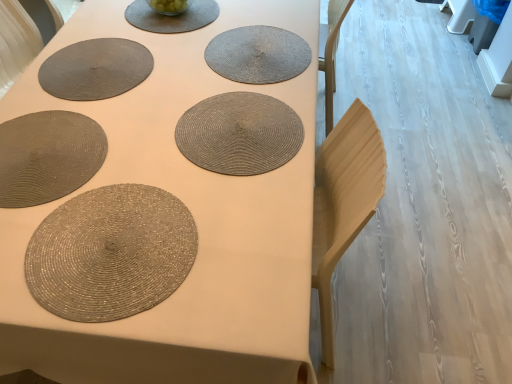
This screenshot has height=384, width=512. Find the location of `free area in between rattan placemat at center, which is the 2th coaster in front-to-back order, and matte gray placemat at upper center`. free area in between rattan placemat at center, which is the 2th coaster in front-to-back order, and matte gray placemat at upper center is located at coordinates (198, 31).